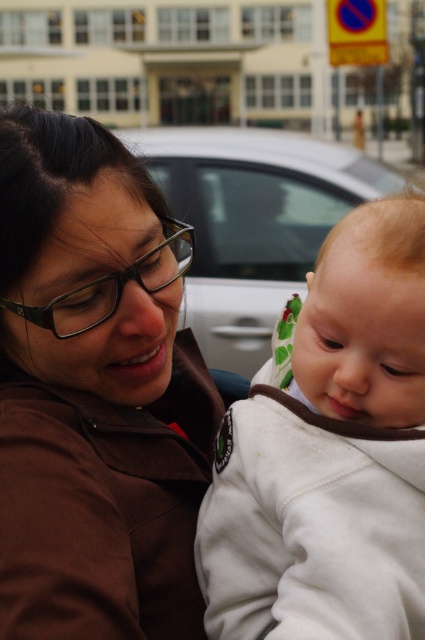
What is the exact coordinate of the brown fabric at center in the image?

The brown fabric at center is located at point (102, 476).